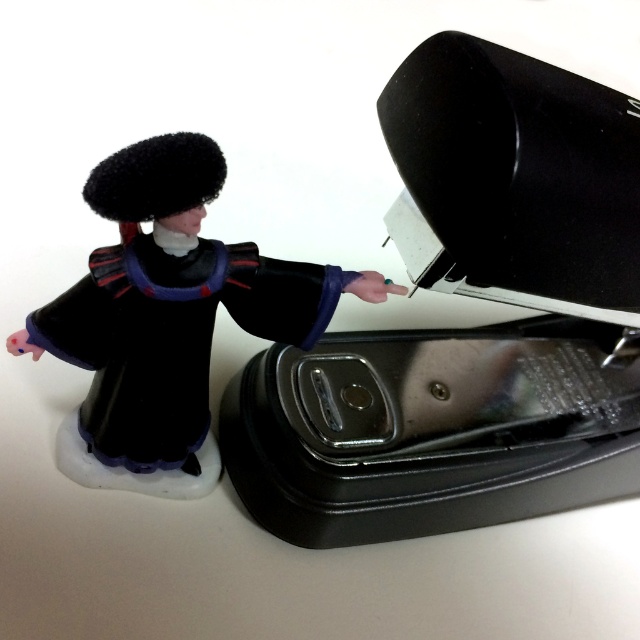
Question: Which point is closer to the camera taking this photo?

Choices:
 (A) (532, 230)
 (B) (228, 268)

Answer: (A)

Question: Which object is closer to the camera taking this photo?

Choices:
 (A) velvet black robe at left
 (B) black matte stapler at upper right

Answer: (B)

Question: Does black matte stapler at upper right appear on the left side of velvet black robe at left?

Choices:
 (A) no
 (B) yes

Answer: (A)

Question: Does black matte stapler at upper right have a greater width compared to velvet black robe at left?

Choices:
 (A) yes
 (B) no

Answer: (A)

Question: Is black matte stapler at upper right thinner than velvet black robe at left?

Choices:
 (A) yes
 (B) no

Answer: (B)

Question: Among these points, which one is nearest to the camera?

Choices:
 (A) (596, 467)
 (B) (42, 324)

Answer: (B)